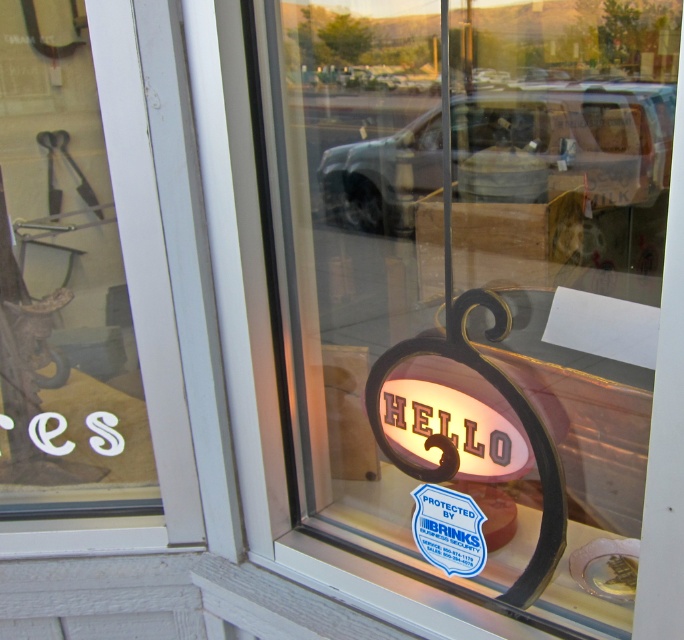
You are a window cleaner who needs to clean both the matte glass sign at center and the white frosted glass at left. Which object requires a larger cleaning surface area?

The matte glass sign at center requires a larger cleaning surface area since it is bigger than the white frosted glass at left.

You are a window cleaner standing 4 feet away from the storefront window. You need to clean the matte glass sign at center. Can you reach it without moving closer?

The matte glass sign at center is 33.98 inches from the camera, which is approximately 2.83 feet. Since you are standing 4 feet away, you are farther than the required distance. Therefore, you can easily reach the matte glass sign at center without needing to move closer.

You are standing in front of the storefront window and want to touch the security sticker. The security sticker is located at point (473, 276) on the window. Is the point where you need to touch located on the matte glass sign at center?

The point (473, 276) is on matte glass sign at center, so yes, the point where you need to touch is located on the matte glass sign at center.